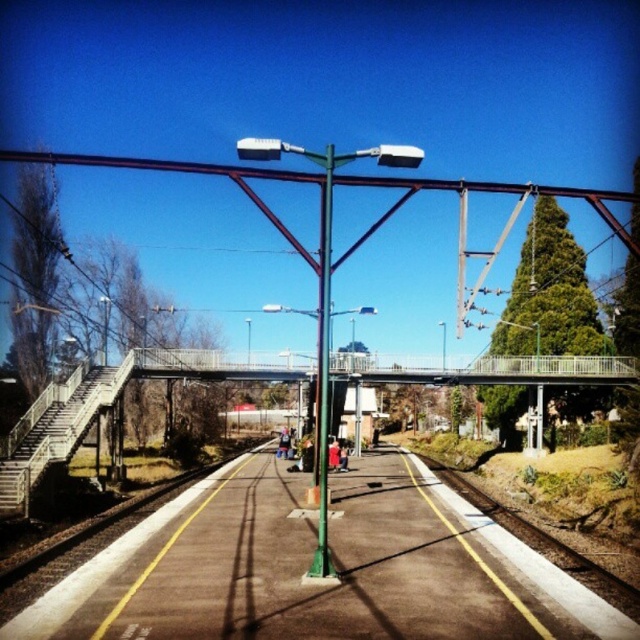
Question: Based on their relative distances, which object is nearer to the green metallic pole at center?

Choices:
 (A) silver metallic train at center
 (B) metallic gray bridge at center

Answer: (B)

Question: Is the position of metallic gray bridge at center more distant than that of green metallic pole at center?

Choices:
 (A) no
 (B) yes

Answer: (B)

Question: Among these objects, which one is farthest from the camera?

Choices:
 (A) silver metallic train at center
 (B) metallic gray bridge at center

Answer: (A)

Question: Estimate the real-world distances between objects in this image. Which object is farther from the green metallic pole at center?

Choices:
 (A) silver metallic train at center
 (B) metallic gray bridge at center

Answer: (A)

Question: Can you confirm if metallic gray bridge at center is bigger than green metallic pole at center?

Choices:
 (A) no
 (B) yes

Answer: (A)

Question: Can you confirm if metallic gray bridge at center is wider than silver metallic train at center?

Choices:
 (A) no
 (B) yes

Answer: (B)